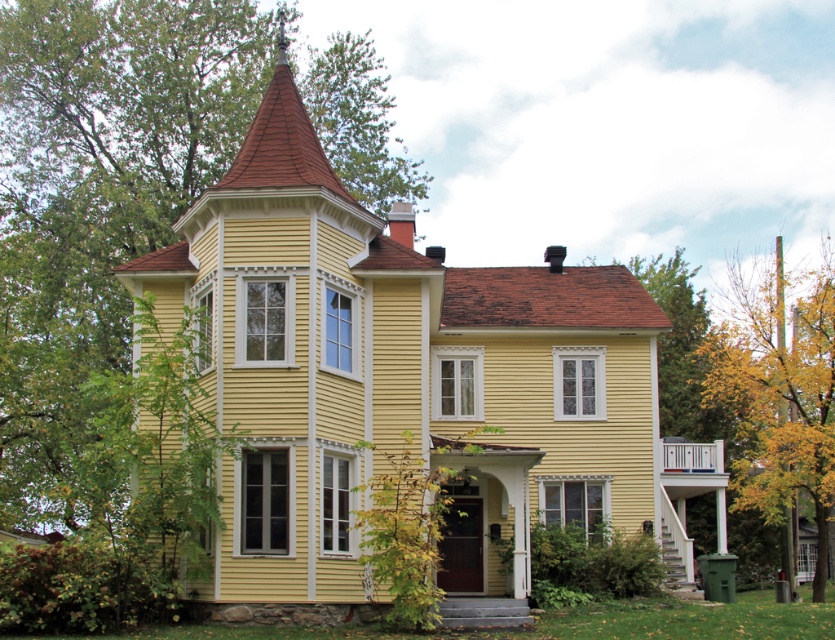
Question: Among these points, which one is farthest from the camera?

Choices:
 (A) (69, 388)
 (B) (828, 444)

Answer: (A)

Question: Where is green leafy tree at upper left located in relation to yellow leafy tree at lower right in the image?

Choices:
 (A) left
 (B) right

Answer: (A)

Question: Can you confirm if green leafy tree at upper left is bigger than yellow leafy tree at lower right?

Choices:
 (A) no
 (B) yes

Answer: (B)

Question: Which of the following is the closest to the observer?

Choices:
 (A) (788, 348)
 (B) (342, 131)

Answer: (A)

Question: Which object appears closest to the camera in this image?

Choices:
 (A) yellow leafy tree at lower right
 (B) green leafy tree at upper left

Answer: (B)

Question: Observing the image, what is the correct spatial positioning of green leafy tree at upper left in reference to yellow leafy tree at lower right?

Choices:
 (A) below
 (B) above

Answer: (B)